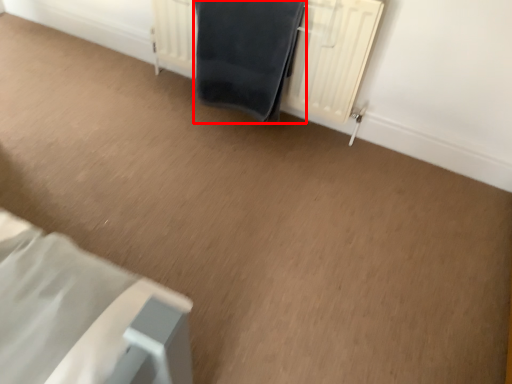
Question: From the image's perspective, what is the correct spatial positioning of bath towel (annotated by the red box) in reference to radiator?

Choices:
 (A) above
 (B) below

Answer: (B)